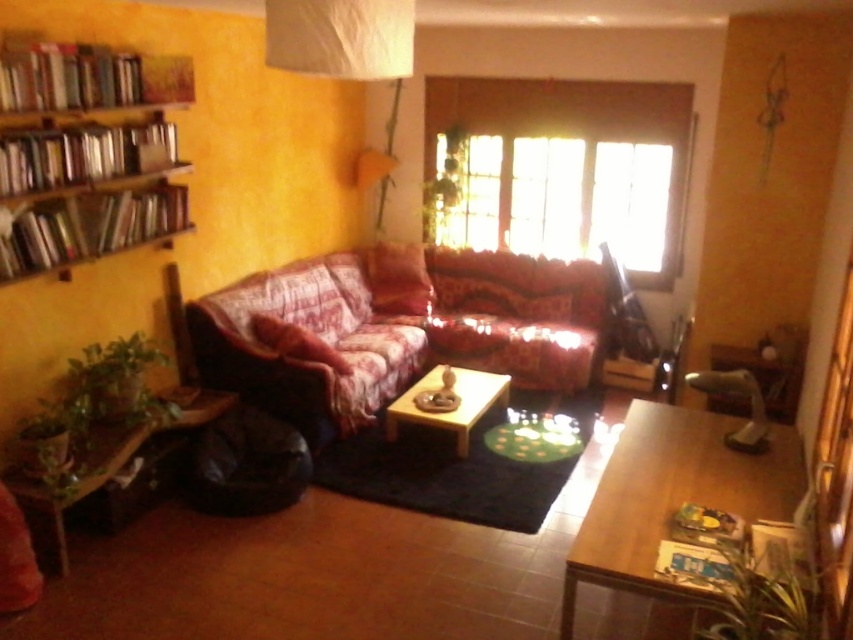
Between green wood table at lower left and wooden coffee table at center, which one appears on the right side from the viewer's perspective?

wooden coffee table at center is more to the right.

Can you confirm if green wood table at lower left is positioned to the right of wooden coffee table at center?

No, green wood table at lower left is not to the right of wooden coffee table at center.

Is point (189, 426) farther from camera compared to point (434, 372)?

No, (189, 426) is closer to viewer.

Locate an element on the screen. The height and width of the screenshot is (640, 853). green wood table at lower left is located at coordinates (107, 464).

Can you confirm if wooden shelves at left is positioned to the left of green wood table at lower left?

Yes, wooden shelves at left is to the left of green wood table at lower left.

Can you confirm if wooden shelves at left is wider than green wood table at lower left?

Incorrect, wooden shelves at left's width does not surpass green wood table at lower left's.

At what (x,y) coordinates should I click in order to perform the action: click on wooden shelves at left. Please return your answer as a coordinate pair (x, y). Looking at the image, I should click on (86, 154).

Does wooden table at lower right have a greater width compared to wooden coffee table at center?

Correct, the width of wooden table at lower right exceeds that of wooden coffee table at center.

Is point (618, 436) positioned behind point (473, 378)?

No, it is not.

Where is `wooden table at lower right`? This screenshot has height=640, width=853. wooden table at lower right is located at coordinates (672, 497).